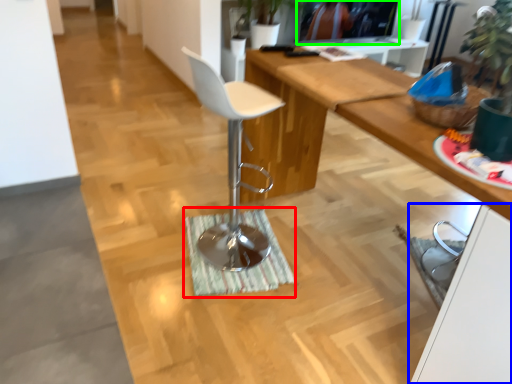
Question: Which object is the farthest from doormat (highlighted by a red box)? Choose among these: cabinetry (highlighted by a blue box) or television (highlighted by a green box).

Choices:
 (A) cabinetry
 (B) television

Answer: (B)